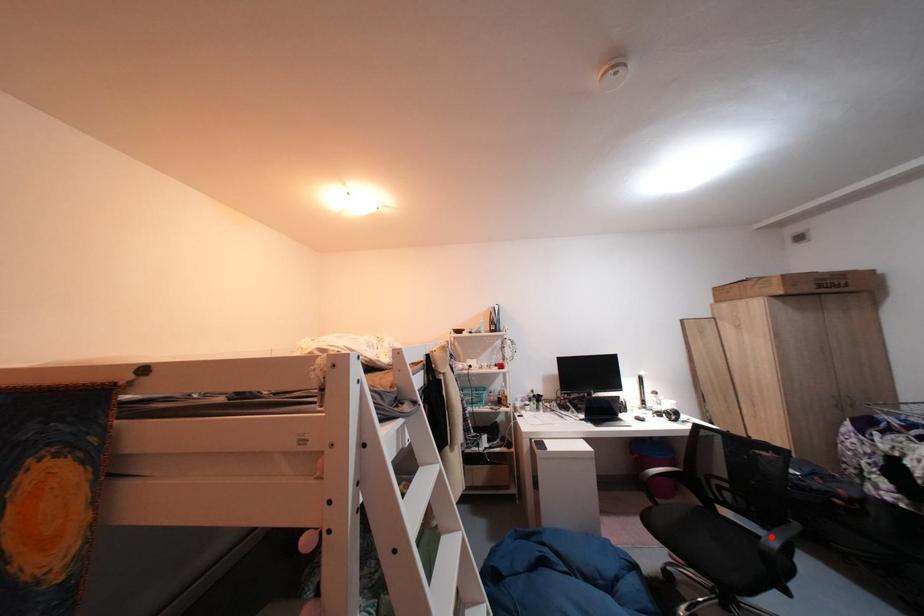
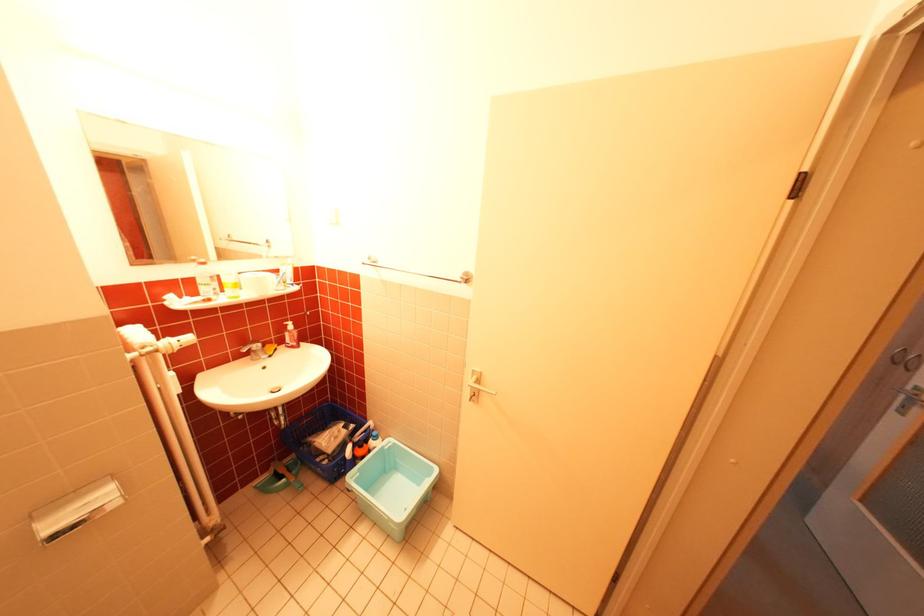
Question: I am providing you with two images of the same scene from different viewpoints. A red point is marked on the first image. Is the red point's position out of view in image 2?

Choices:
 (A) Yes
 (B) No

Answer: (A)